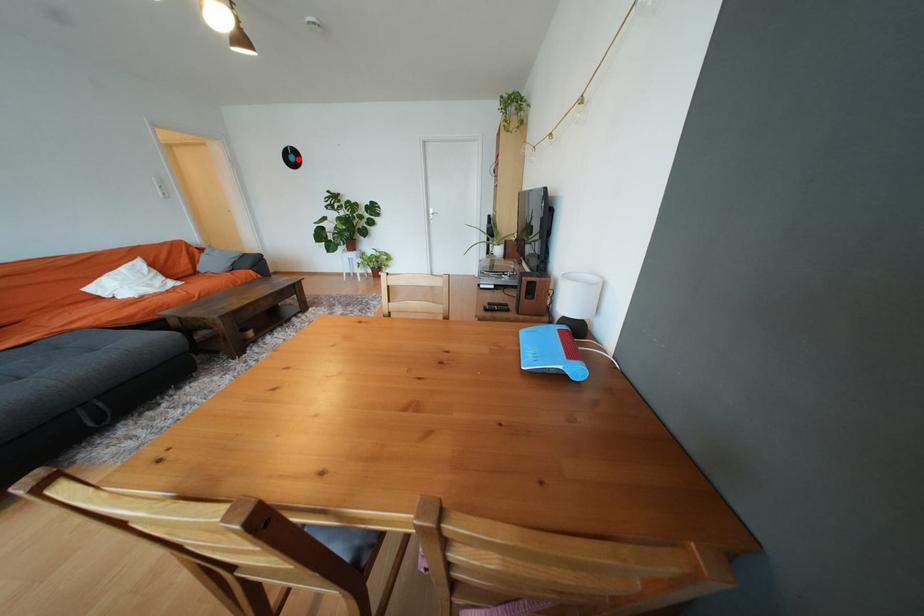
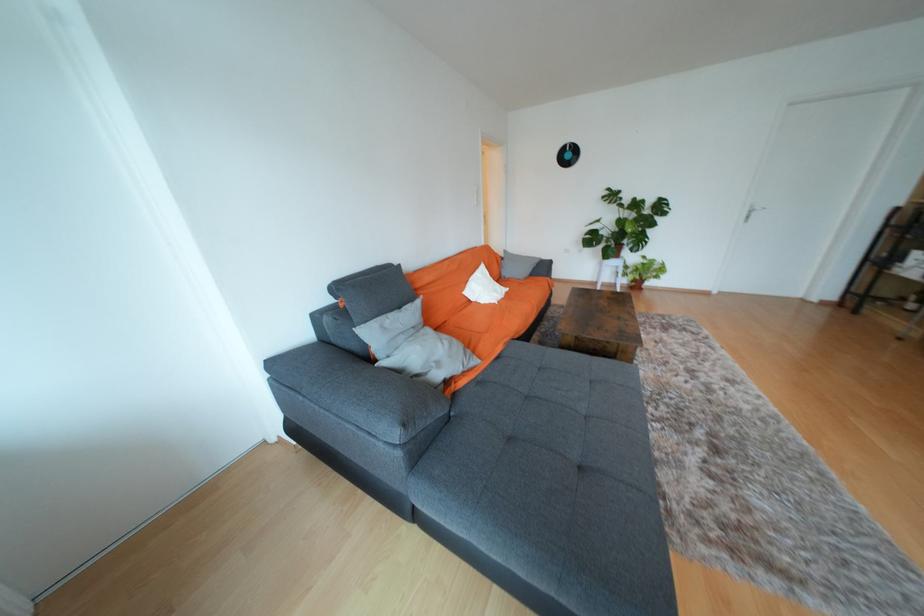
Find the pixel in the second image that matches the highlighted location in the first image.

(574, 156)